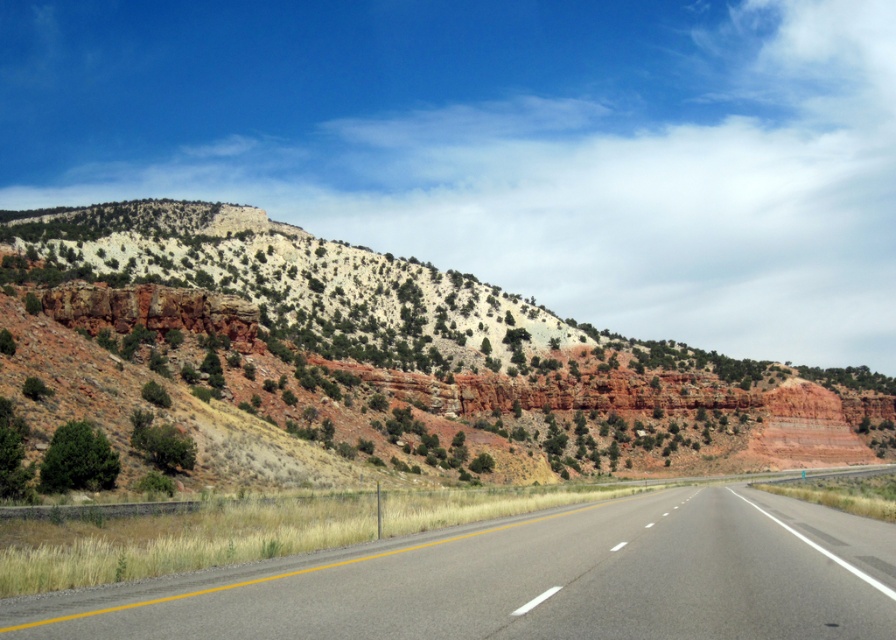
The width and height of the screenshot is (896, 640). Describe the element at coordinates (390, 355) in the screenshot. I see `rustic rock formation at center` at that location.

Can you confirm if rustic rock formation at center is positioned above gray asphalt highway at center?

Indeed, rustic rock formation at center is positioned over gray asphalt highway at center.

Between point (205, 284) and point (69, 627), which one is positioned in front?

Point (69, 627) is in front.

Locate an element on the screen. rustic rock formation at center is located at coordinates (390, 355).